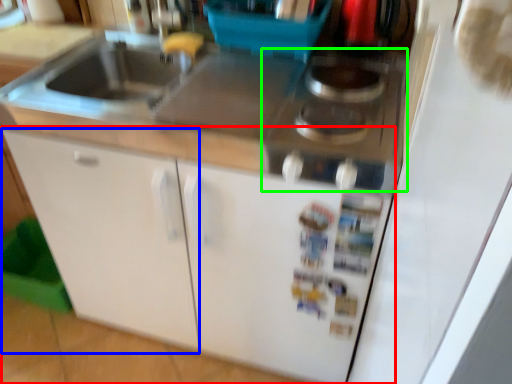
Question: Considering the real-world distances, which object is closest to cabinetry (highlighted by a red box)? cabinetry (highlighted by a blue box) or gas stove (highlighted by a green box).

Choices:
 (A) cabinetry
 (B) gas stove

Answer: (A)